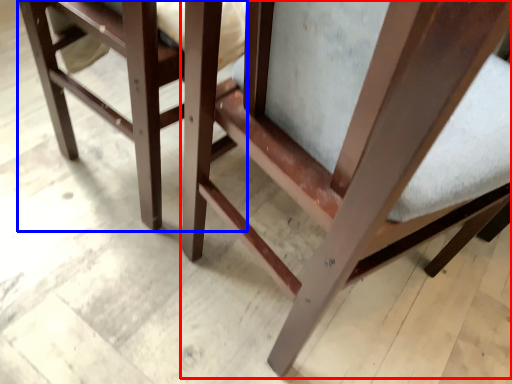
Question: Among these objects, which one is farthest to the camera, chair (highlighted by a red box) or furniture (highlighted by a blue box)?

Choices:
 (A) chair
 (B) furniture

Answer: (B)